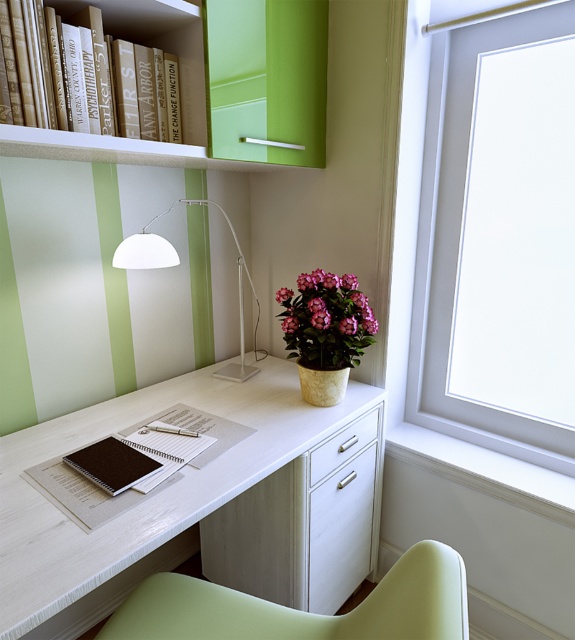
You are a delivery robot with a package that is 30 inches long. You need to move the package from the transparent glass window at upper right to the white wood table at center. Can you carry the package through the space between them without bending it?

The distance between the white wood table at center and the transparent glass window at upper right is 28.30 inches. Since the package is 30 inches long, it cannot be carried straight through the space without bending or repositioning it because the available space is shorter than the package length.

You are sitting at the white wood table at center and want to look out the transparent glass window at upper right. Which direction should you turn your head to look towards the window?

Since the transparent glass window at upper right is farther from the viewer than the white wood table at center, you should turn your head to the right to look towards the transparent glass window at upper right.

Based on the photo, you are setting up a small decorative item on the desk and want to ensure it fits properly. Given the white wood table at center and the matte black notebook at center, which object has more space available for placing additional items?

The white wood table at center has a larger size compared to the matte black notebook at center, so there is more space available on the white wood table at center for placing additional items.